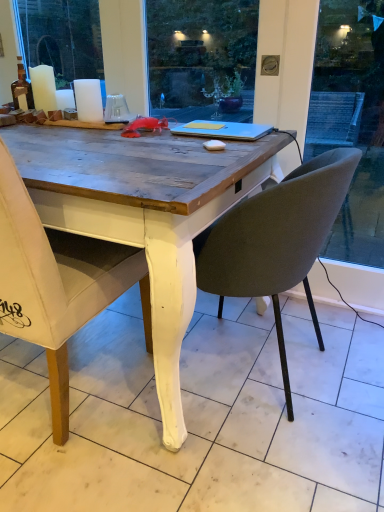
Question: Are matte gray chair at center, the second chair from the left, and white fabric chair at left, the 1th chair when ordered from left to right, making contact?

Choices:
 (A) no
 (B) yes

Answer: (A)

Question: Is matte gray chair at center, the second chair from the left, bigger than white fabric chair at left, which is the second chair from right to left?

Choices:
 (A) yes
 (B) no

Answer: (B)

Question: Considering the relative positions of matte gray chair at center, the second chair from the left, and white fabric chair at left, the 1th chair when ordered from left to right, in the image provided, is matte gray chair at center, the second chair from the left, in front of white fabric chair at left, the 1th chair when ordered from left to right,?

Choices:
 (A) no
 (B) yes

Answer: (A)

Question: Is matte gray chair at center, the second chair from the left, not near white fabric chair at left, which is the second chair from right to left?

Choices:
 (A) yes
 (B) no

Answer: (B)

Question: Is matte gray chair at center, the second chair from the left, shorter than white fabric chair at left, which is the second chair from right to left?

Choices:
 (A) yes
 (B) no

Answer: (A)

Question: From a real-world perspective, is matte gray chair at center, acting as the first chair starting from the right, under white fabric chair at left, the 1th chair when ordered from left to right?

Choices:
 (A) no
 (B) yes

Answer: (B)

Question: Can you confirm if white matte candle at upper left, acting as the 1th candle starting from the right, is positioned to the right of white fabric chair at left, which is the second chair from right to left?

Choices:
 (A) yes
 (B) no

Answer: (A)

Question: Is white matte candle at upper left, acting as the 1th candle starting from the right, with white fabric chair at left, which is the second chair from right to left?

Choices:
 (A) no
 (B) yes

Answer: (A)

Question: Is white matte candle at upper left, acting as the 1th candle starting from the right, oriented towards white fabric chair at left, the 1th chair when ordered from left to right?

Choices:
 (A) yes
 (B) no

Answer: (A)

Question: Is white matte candle at upper left, acting as the 1th candle starting from the right, completely or partially outside of white fabric chair at left, which is the second chair from right to left?

Choices:
 (A) no
 (B) yes

Answer: (B)

Question: Is white matte candle at upper left, arranged as the 2th candle when viewed from the left, positioned behind white fabric chair at left, the 1th chair when ordered from left to right?

Choices:
 (A) yes
 (B) no

Answer: (A)

Question: Is white matte candle at upper left, acting as the 1th candle starting from the right, far away from white fabric chair at left, the 1th chair when ordered from left to right?

Choices:
 (A) yes
 (B) no

Answer: (B)

Question: Is there a large distance between white matte candle at upper left, acting as the 1th candle starting from the right, and blue matte laptop at center?

Choices:
 (A) yes
 (B) no

Answer: (B)